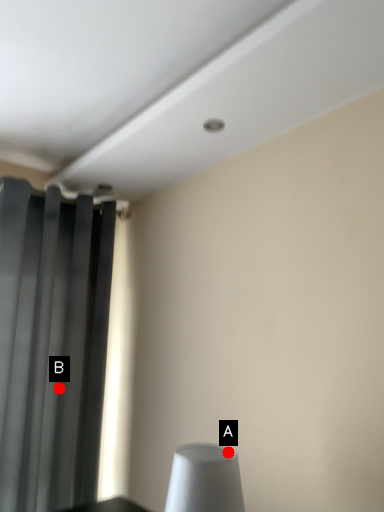
Question: Two points are circled on the image, labeled by A and B beside each circle. Which point is farther to the camera?

Choices:
 (A) A is further
 (B) B is further

Answer: (B)